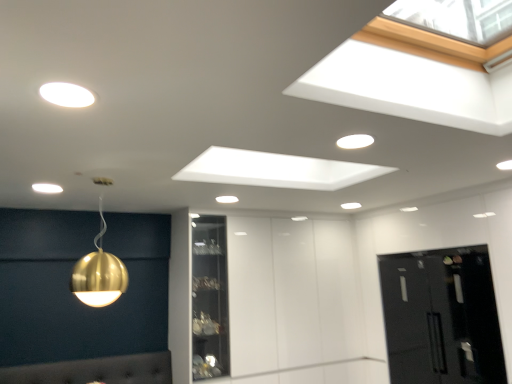
How much space does matte gold sphere at upper center, placed as the first lamp when sorted from right to left, occupy vertically?

It is 1.87 centimeters.

I want to click on gold metallic sphere at upper left, the 2th lamp when ordered from left to right, so click(99, 273).

What do you see at coordinates (441, 317) in the screenshot? The image size is (512, 384). I see `black glass door at lower right` at bounding box center [441, 317].

Describe the element at coordinates (66, 94) in the screenshot. I see `matte white light fixture at upper left, the 3th lamp viewed from the left` at that location.

What is the approximate height of matte gold sphere at upper center, which ranks as the 3th lamp in top-to-bottom order?

It is 0.74 inches.

This screenshot has height=384, width=512. Identify the location of matte gold sphere at upper center, acting as the 5th lamp starting from the left. (351, 206).

Is matte gold sphere at upper center, marked as the first lamp in a back-to-front arrangement, further to the viewer compared to gold metallic sphere at upper left, the 5th lamp in the top-to-bottom sequence?

Yes, matte gold sphere at upper center, marked as the first lamp in a back-to-front arrangement, is behind gold metallic sphere at upper left, the 5th lamp in the top-to-bottom sequence.

You are a GUI agent. You are given a task and a screenshot of the screen. Output one action in this format:
    pyautogui.click(x=<x>, y=<y>)
    Task: Click on the lamp lying below the matte gold sphere at upper center, the 4th lamp in the top-to-bottom sequence (from the image's perspective)
    This screenshot has width=512, height=384.
    Given the screenshot: What is the action you would take?
    pyautogui.click(x=99, y=273)

Looking at the image, does matte gold sphere at upper center, the fifth lamp from the front, seem bigger or smaller compared to gold metallic sphere at upper left, which is counted as the 4th lamp, starting from the right?

Considering their sizes, matte gold sphere at upper center, the fifth lamp from the front, takes up less space than gold metallic sphere at upper left, which is counted as the 4th lamp, starting from the right.

From a real-world perspective, is matte gold sphere at upper center, marked as the first lamp in a back-to-front arrangement, on top of gold metallic sphere at upper left, the fourth lamp when ordered from back to front?

Yes, from a real-world perspective, matte gold sphere at upper center, marked as the first lamp in a back-to-front arrangement, is over gold metallic sphere at upper left, the fourth lamp when ordered from back to front

Considering the sizes of matte gold sphere at upper left, which is counted as the fourth lamp, starting from the bottom, and matte gold sphere at upper center, marked as the first lamp in a back-to-front arrangement, in the image, is matte gold sphere at upper left, which is counted as the fourth lamp, starting from the bottom, wider or thinner than matte gold sphere at upper center, marked as the first lamp in a back-to-front arrangement,?

Considering their sizes, matte gold sphere at upper left, which is counted as the fourth lamp, starting from the bottom, looks slimmer than matte gold sphere at upper center, marked as the first lamp in a back-to-front arrangement.

Where is `lamp that is the 2nd object located in front of the matte gold sphere at upper center, placed as the first lamp when sorted from right to left`? This screenshot has height=384, width=512. lamp that is the 2nd object located in front of the matte gold sphere at upper center, placed as the first lamp when sorted from right to left is located at coordinates (47, 188).

From the picture: From the image's perspective, who appears lower, matte gold sphere at upper left, which is counted as the fourth lamp, starting from the bottom, or matte gold sphere at upper center, the fifth lamp from the front?

From the image's view, matte gold sphere at upper center, the fifth lamp from the front, is below.

Can you confirm if matte gold sphere at upper left, the 3th lamp when ordered from front to back, is taller than matte gold sphere at upper center, acting as the 5th lamp starting from the left?

In fact, matte gold sphere at upper left, the 3th lamp when ordered from front to back, may be shorter than matte gold sphere at upper center, acting as the 5th lamp starting from the left.

Would you say matte white light fixture at upper left, the 3th lamp viewed from the left, is inside or outside matte gold sphere at upper center, marked as the first lamp in a back-to-front arrangement?

matte white light fixture at upper left, the 3th lamp viewed from the left, lies outside matte gold sphere at upper center, marked as the first lamp in a back-to-front arrangement.

Considering the sizes of objects matte white light fixture at upper left, acting as the 1th lamp starting from the top, and matte gold sphere at upper center, placed as the first lamp when sorted from right to left, in the image provided, who is bigger, matte white light fixture at upper left, acting as the 1th lamp starting from the top, or matte gold sphere at upper center, placed as the first lamp when sorted from right to left,?

With larger size is matte gold sphere at upper center, placed as the first lamp when sorted from right to left.

In order to click on the 2nd lamp counting from the left side of the matte gold sphere at upper center, arranged as the second lamp when ordered from the bottom in this screenshot , I will do `click(66, 94)`.

Would you say matte white light fixture at upper left, the 3th lamp viewed from the left, is to the left or to the right of matte gold sphere at upper center, placed as the first lamp when sorted from right to left, in the picture?

matte white light fixture at upper left, the 3th lamp viewed from the left, is to the left of matte gold sphere at upper center, placed as the first lamp when sorted from right to left.

Is black glass door at lower right surrounded by matte gold sphere at upper center, which is the second lamp from right to left?

No, matte gold sphere at upper center, which is the second lamp from right to left, does not contain black glass door at lower right.

Is matte gold sphere at upper center, the fourth lamp positioned from the front, bigger than black glass door at lower right?

Incorrect, matte gold sphere at upper center, the fourth lamp positioned from the front, is not larger than black glass door at lower right.

Is matte gold sphere at upper center, positioned as the fourth lamp in left-to-right order, at the right side of black glass door at lower right?

In fact, matte gold sphere at upper center, positioned as the fourth lamp in left-to-right order, is to the left of black glass door at lower right.

Can you confirm if matte gold sphere at upper center, positioned as the third lamp in bottom-to-top order, is wider than black glass door at lower right?

In fact, matte gold sphere at upper center, positioned as the third lamp in bottom-to-top order, might be narrower than black glass door at lower right.

Considering the sizes of objects matte gold sphere at upper center, placed as the first lamp when sorted from right to left, and matte gold sphere at upper center, positioned as the fourth lamp in left-to-right order, in the image provided, who is wider, matte gold sphere at upper center, placed as the first lamp when sorted from right to left, or matte gold sphere at upper center, positioned as the fourth lamp in left-to-right order,?

With larger width is matte gold sphere at upper center, placed as the first lamp when sorted from right to left.

Between matte gold sphere at upper center, marked as the first lamp in a back-to-front arrangement, and matte gold sphere at upper center, which is the 2th lamp in back-to-front order, which one has larger size?

With larger size is matte gold sphere at upper center, marked as the first lamp in a back-to-front arrangement.

Is matte gold sphere at upper center, the fifth lamp from the front, at the right side of matte gold sphere at upper center, positioned as the fourth lamp in left-to-right order?

Yes, matte gold sphere at upper center, the fifth lamp from the front, is to the right of matte gold sphere at upper center, positioned as the fourth lamp in left-to-right order.

Is matte gold sphere at upper center, the 4th lamp in the top-to-bottom sequence, taller than matte gold sphere at upper center, which is the 2th lamp in back-to-front order?

No.

From the image's perspective, who appears lower, matte white light fixture at upper left, which is the 1th lamp from front to back, or matte gold sphere at upper left, which is the 5th lamp in right-to-left order?

matte gold sphere at upper left, which is the 5th lamp in right-to-left order, is shown below in the image.

Considering the relative positions of matte white light fixture at upper left, which is the 5th lamp from back to front, and matte gold sphere at upper left, which is the 5th lamp in right-to-left order, in the image provided, is matte white light fixture at upper left, which is the 5th lamp from back to front, to the left or to the right of matte gold sphere at upper left, which is the 5th lamp in right-to-left order,?

From the image, it's evident that matte white light fixture at upper left, which is the 5th lamp from back to front, is to the right of matte gold sphere at upper left, which is the 5th lamp in right-to-left order.

Does matte white light fixture at upper left, the fifth lamp from the bottom, come behind matte gold sphere at upper left, the 3th lamp when ordered from front to back?

No, matte white light fixture at upper left, the fifth lamp from the bottom, is closer to the camera.

Based on the photo, is matte white light fixture at upper left, the fifth lamp from the bottom, in contact with matte gold sphere at upper left, the 3th lamp when ordered from front to back?

No, matte white light fixture at upper left, the fifth lamp from the bottom, is not with matte gold sphere at upper left, the 3th lamp when ordered from front to back.

I want to click on the 3rd lamp to the right when counting from the matte gold sphere at upper left, the 3th lamp when ordered from front to back, so click(x=227, y=199).

Can we say matte gold sphere at upper center, which is the 2th lamp in back-to-front order, lies outside matte gold sphere at upper left, the 3th lamp when ordered from front to back?

Yes, matte gold sphere at upper center, which is the 2th lamp in back-to-front order, is outside of matte gold sphere at upper left, the 3th lamp when ordered from front to back.

Considering their positions, is matte gold sphere at upper center, which is the second lamp from right to left, located in front of or behind matte gold sphere at upper left, which is counted as the fourth lamp, starting from the bottom?

Clearly, matte gold sphere at upper center, which is the second lamp from right to left, is behind matte gold sphere at upper left, which is counted as the fourth lamp, starting from the bottom.

From a real-world perspective, is matte gold sphere at upper center, which ranks as the 3th lamp in top-to-bottom order, physically located above or below matte gold sphere at upper left, which is counted as the fourth lamp, starting from the bottom?

In terms of real-world spatial position, matte gold sphere at upper center, which ranks as the 3th lamp in top-to-bottom order, is above matte gold sphere at upper left, which is counted as the fourth lamp, starting from the bottom.

Where is `the 3rd lamp behind the gold metallic sphere at upper left, the 2th lamp when ordered from left to right, starting your count from the anchor`? the 3rd lamp behind the gold metallic sphere at upper left, the 2th lamp when ordered from left to right, starting your count from the anchor is located at coordinates (351, 206).

From the image's perspective, which lamp is the 2nd one above the matte gold sphere at upper center, placed as the first lamp when sorted from right to left? Please provide its 2D coordinates.

[(47, 188)]

Based on their spatial positions, is matte gold sphere at upper center, which is the second lamp from right to left, or matte gold sphere at upper center, placed as the first lamp when sorted from right to left, closer to matte white light fixture at upper left, which is the 1th lamp from front to back?

Based on the image, matte gold sphere at upper center, which is the second lamp from right to left, appears to be nearer to matte white light fixture at upper left, which is the 1th lamp from front to back.

Looking at the image, which one is located closer to matte white light fixture at upper left, acting as the 1th lamp starting from the top, matte gold sphere at upper center, marked as the first lamp in a back-to-front arrangement, or matte gold sphere at upper center, positioned as the fourth lamp in left-to-right order?

matte gold sphere at upper center, positioned as the fourth lamp in left-to-right order, is positioned closer to the anchor matte white light fixture at upper left, acting as the 1th lamp starting from the top.

Looking at the image, which one is located closer to matte gold sphere at upper left, the 3th lamp when ordered from back to front, matte white light fixture at upper left, which ranks as the third lamp in right-to-left order, or matte gold sphere at upper center, acting as the 5th lamp starting from the left?

Among the two, matte white light fixture at upper left, which ranks as the third lamp in right-to-left order, is located nearer to matte gold sphere at upper left, the 3th lamp when ordered from back to front.

When comparing their distances from matte gold sphere at upper left, the second lamp viewed from the top, does gold metallic sphere at upper left, which is counted as the 4th lamp, starting from the right, or black glass door at lower right seem closer?

gold metallic sphere at upper left, which is counted as the 4th lamp, starting from the right.

When comparing their distances from matte gold sphere at upper left, which is counted as the fourth lamp, starting from the bottom, does matte gold sphere at upper center, positioned as the third lamp in bottom-to-top order, or matte white light fixture at upper left, which ranks as the third lamp in right-to-left order, seem closer?

matte gold sphere at upper center, positioned as the third lamp in bottom-to-top order, is closer to matte gold sphere at upper left, which is counted as the fourth lamp, starting from the bottom.

Estimate the real-world distances between objects in this image. Which object is closer to matte gold sphere at upper center, arranged as the second lamp when ordered from the bottom, black glass door at lower right or matte gold sphere at upper left, the 3th lamp when ordered from back to front?

Among the two, black glass door at lower right is located nearer to matte gold sphere at upper center, arranged as the second lamp when ordered from the bottom.

In the scene shown: Which object lies nearer to the anchor point matte gold sphere at upper left, the 1th lamp viewed from the left, matte gold sphere at upper center, arranged as the second lamp when ordered from the bottom, or black glass door at lower right?

Among the two, matte gold sphere at upper center, arranged as the second lamp when ordered from the bottom, is located nearer to matte gold sphere at upper left, the 1th lamp viewed from the left.

Looking at the image, which one is located closer to matte white light fixture at upper left, which ranks as the third lamp in right-to-left order, matte gold sphere at upper center, the 4th lamp in the top-to-bottom sequence, or black glass door at lower right?

The object closer to matte white light fixture at upper left, which ranks as the third lamp in right-to-left order, is matte gold sphere at upper center, the 4th lamp in the top-to-bottom sequence.

You are a GUI agent. You are given a task and a screenshot of the screen. Output one action in this format:
    pyautogui.click(x=<x>, y=<y>)
    Task: Click on the lamp between matte gold sphere at upper center, positioned as the fourth lamp in left-to-right order, and black glass door at lower right, in the horizontal direction
    
    Given the screenshot: What is the action you would take?
    pyautogui.click(x=351, y=206)

Where is `glass door between matte white light fixture at upper left, which is the 5th lamp from back to front, and matte gold sphere at upper center, the 4th lamp in the top-to-bottom sequence, from front to back`? The height and width of the screenshot is (384, 512). glass door between matte white light fixture at upper left, which is the 5th lamp from back to front, and matte gold sphere at upper center, the 4th lamp in the top-to-bottom sequence, from front to back is located at coordinates (441, 317).

You are a GUI agent. You are given a task and a screenshot of the screen. Output one action in this format:
    pyautogui.click(x=<x>, y=<y>)
    Task: Click on the lamp located between matte white light fixture at upper left, which is the 5th lamp from back to front, and matte gold sphere at upper left, the 3th lamp when ordered from front to back, in the depth direction
    This screenshot has height=384, width=512.
    Given the screenshot: What is the action you would take?
    pyautogui.click(x=99, y=273)